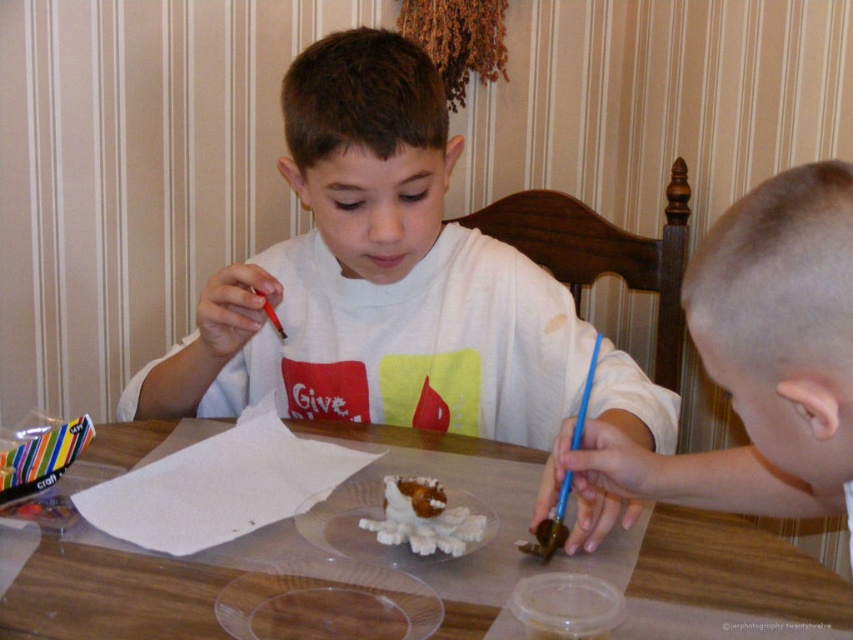
Question: Does white matte shirt at center appear under white fluffy cake at center?

Choices:
 (A) no
 (B) yes

Answer: (A)

Question: Which point is farther to the camera?

Choices:
 (A) white matte shirt at center
 (B) white fluffy cake at center
 (C) blonde hair at right
 (D) transparent plastic table at center

Answer: (A)

Question: Among these points, which one is nearest to the camera?

Choices:
 (A) (444, 548)
 (B) (764, 422)
 (C) (361, 401)
 (D) (47, 628)

Answer: (B)

Question: Does transparent plastic table at center have a smaller size compared to white fluffy cake at center?

Choices:
 (A) no
 (B) yes

Answer: (A)

Question: Is blonde hair at right above transparent plastic table at center?

Choices:
 (A) no
 (B) yes

Answer: (B)

Question: Based on their relative distances, which object is farther from the transparent plastic table at center?

Choices:
 (A) white matte shirt at center
 (B) blonde hair at right
 (C) white fluffy cake at center

Answer: (B)